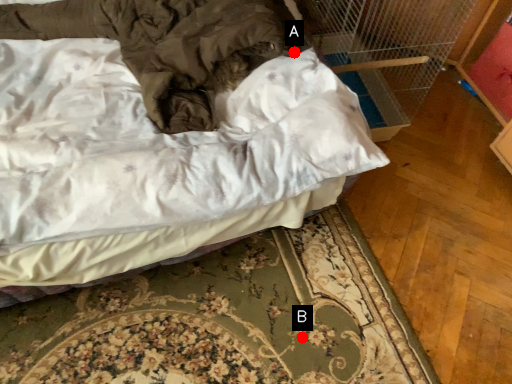
Question: Two points are circled on the image, labeled by A and B beside each circle. Among these points, which one is nearest to the camera?

Choices:
 (A) A is closer
 (B) B is closer

Answer: (B)